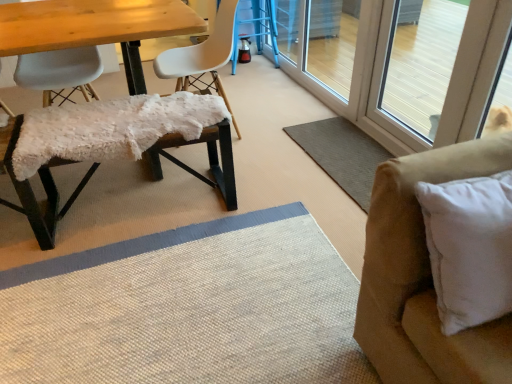
Question: Does point (37, 71) appear closer or farther from the camera than point (453, 294)?

Choices:
 (A) farther
 (B) closer

Answer: (A)

Question: From the image's perspective, is matte white plastic chair at left, marked as the 1th chair in a left-to-right arrangement, positioned above or below white soft pillow at right?

Choices:
 (A) above
 (B) below

Answer: (A)

Question: Which is nearer to the white matte chair at center, which is the 1th chair in right-to-left order?

Choices:
 (A) white soft pillow at right
 (B) beige textured mat at right
 (C) matte white plastic chair at left, the 3th chair viewed from the right
 (D) transparent glass screen door at right, which is the 2th screen door in back-to-front order
 (E) white fluffy bench at left, arranged as the 2th chair when viewed from the right

Answer: (C)

Question: Estimate the real-world distances between objects in this image. Which object is farther from the white fluffy bench at left, arranged as the 2th chair when viewed from the right?

Choices:
 (A) suede beige couch at right
 (B) white matte chair at center, which is the 1th chair in right-to-left order
 (C) transparent glass screen door at upper right, marked as the second screen door in a front-to-back arrangement
 (D) beige textured mat at right
 (E) matte white plastic chair at left, marked as the 1th chair in a left-to-right arrangement

Answer: (C)